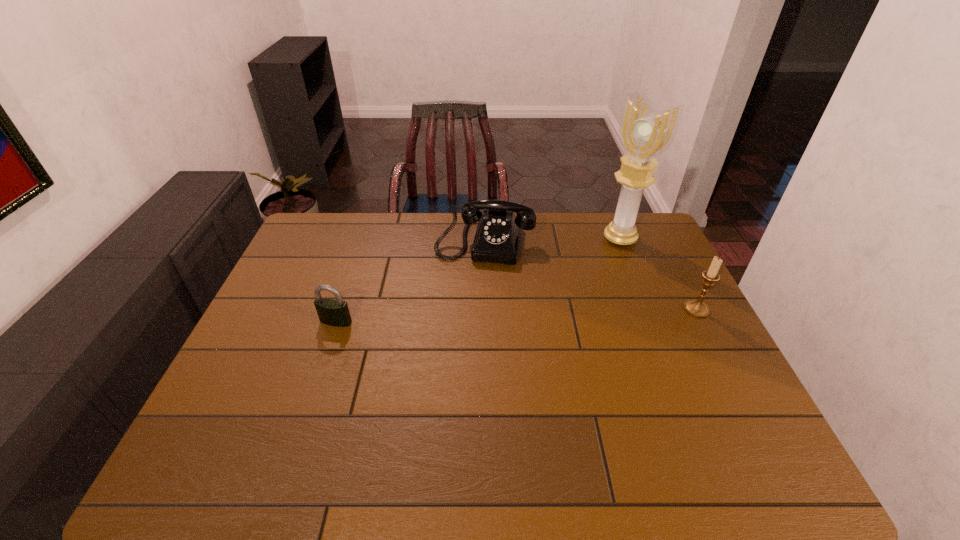
In the image, there is a desktop. Find the location of `free space at the far edge`. free space at the far edge is located at coordinates (572, 224).

Find the location of a particular element. The image size is (960, 540). vacant area at the near edge of the desktop is located at coordinates (519, 431).

In the image, there is a desktop. In order to click on vacant space at the left edge in this screenshot , I will do `click(317, 312)`.

Locate an element on the screen. Image resolution: width=960 pixels, height=540 pixels. vacant space at the right edge of the desktop is located at coordinates (672, 341).

The height and width of the screenshot is (540, 960). Find the location of `vacant region at the far left corner of the desktop`. vacant region at the far left corner of the desktop is located at coordinates (306, 233).

Image resolution: width=960 pixels, height=540 pixels. In the image, there is a desktop. In order to click on vacant space at the near right corner in this screenshot , I will do `click(752, 418)`.

Where is `unoccupied position between the padlock and the second object from right to left`? This screenshot has height=540, width=960. unoccupied position between the padlock and the second object from right to left is located at coordinates (478, 280).

Find the location of a particular element. The width and height of the screenshot is (960, 540). free space between the rightmost object and the third object from left to right is located at coordinates (659, 274).

Find the location of a particular element. Image resolution: width=960 pixels, height=540 pixels. vacant region between the telephone and the padlock is located at coordinates (410, 281).

The width and height of the screenshot is (960, 540). I want to click on free space between the candle holder and the shortest object, so click(x=516, y=315).